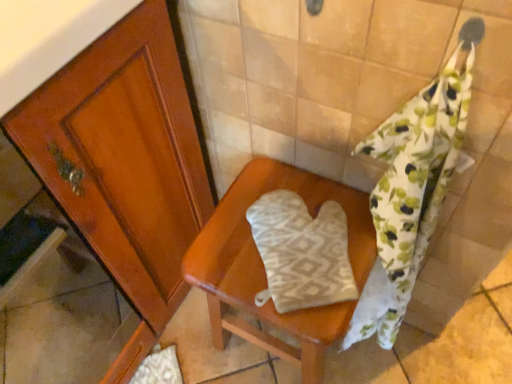
The height and width of the screenshot is (384, 512). What are the coordinates of `vacant space to the right of floral cotton towel at right` in the screenshot? It's located at pos(423,355).